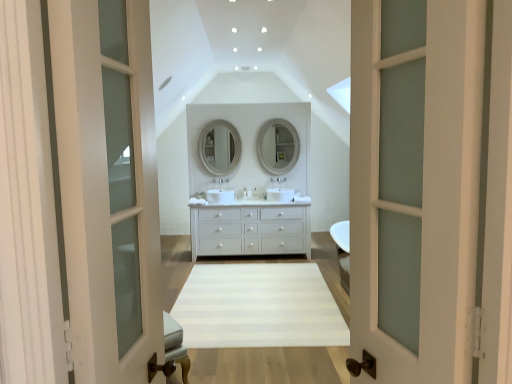
Question: Should I look upward or downward to see white striped rug at center?

Choices:
 (A) up
 (B) down

Answer: (B)

Question: From a real-world perspective, is matte white mirror at center, which is counted as the 1th mirror, starting from the right, positioned under white glossy sink at center based on gravity?

Choices:
 (A) no
 (B) yes

Answer: (A)

Question: Considering the relative positions of matte white mirror at center, which is counted as the 1th mirror, starting from the right, and white glossy sink at center in the image provided, is matte white mirror at center, which is counted as the 1th mirror, starting from the right, to the right of white glossy sink at center from the viewer's perspective?

Choices:
 (A) yes
 (B) no

Answer: (B)

Question: Is matte white mirror at center, which is counted as the 1th mirror, starting from the right, smaller than white glossy sink at center?

Choices:
 (A) yes
 (B) no

Answer: (B)

Question: Is the position of matte white mirror at center, which is the 2th mirror from left to right, less distant than that of white glossy sink at center?

Choices:
 (A) yes
 (B) no

Answer: (B)

Question: From a real-world perspective, is matte white mirror at center, which is the 2th mirror from left to right, located higher than white glossy sink at center?

Choices:
 (A) yes
 (B) no

Answer: (A)

Question: Does matte white mirror at center, which is counted as the 1th mirror, starting from the right, have a lesser height compared to white glossy sink at center?

Choices:
 (A) no
 (B) yes

Answer: (A)

Question: Is white glossy mirror at center, which appears as the first mirror when viewed from the left, oriented towards white matte chest of drawers at center?

Choices:
 (A) no
 (B) yes

Answer: (A)

Question: From the image's perspective, is white glossy mirror at center, which appears as the second mirror when viewed from the right, under white matte chest of drawers at center?

Choices:
 (A) yes
 (B) no

Answer: (B)

Question: Can you confirm if white glossy mirror at center, which appears as the first mirror when viewed from the left, is wider than white matte chest of drawers at center?

Choices:
 (A) yes
 (B) no

Answer: (B)

Question: Is white glossy mirror at center, which appears as the second mirror when viewed from the right, next to white matte chest of drawers at center?

Choices:
 (A) yes
 (B) no

Answer: (B)

Question: Does white glossy mirror at center, which appears as the first mirror when viewed from the left, contain white matte chest of drawers at center?

Choices:
 (A) yes
 (B) no

Answer: (B)

Question: Is white glossy mirror at center, which appears as the first mirror when viewed from the left, closer to the viewer compared to white matte chest of drawers at center?

Choices:
 (A) no
 (B) yes

Answer: (A)

Question: Considering the relative sizes of matte silver faucet at center, marked as the 2th faucet in a left-to-right arrangement, and white matte chest of drawers at center in the image provided, is matte silver faucet at center, marked as the 2th faucet in a left-to-right arrangement, smaller than white matte chest of drawers at center?

Choices:
 (A) no
 (B) yes

Answer: (B)